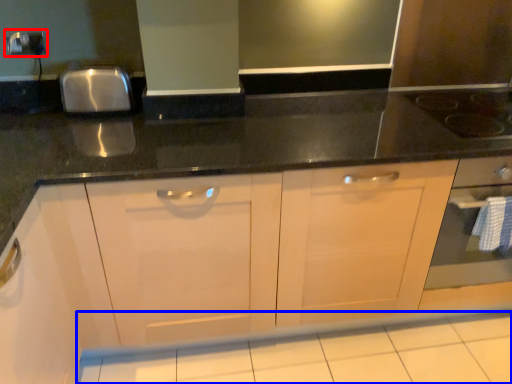
Question: Among these objects, which one is nearest to the camera, electric outlet (highlighted by a red box) or tile (highlighted by a blue box)?

Choices:
 (A) electric outlet
 (B) tile

Answer: (B)